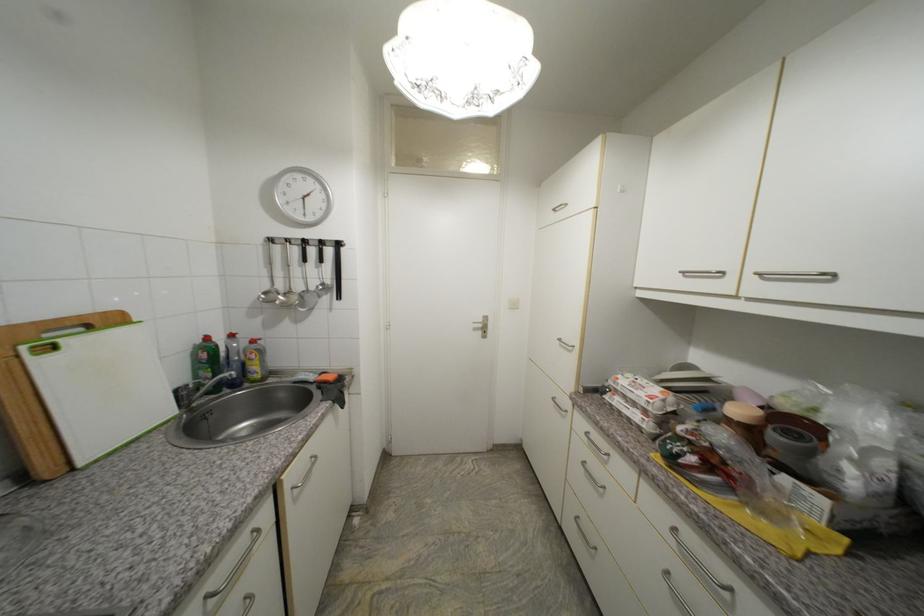
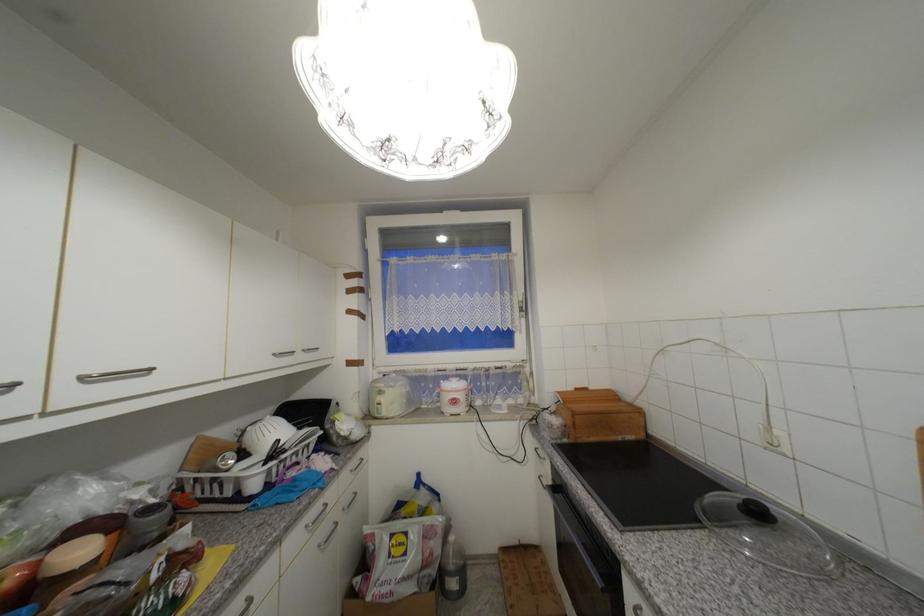
In the second image, find the point that corresponds to pixel 728 274 in the first image.

(19, 386)